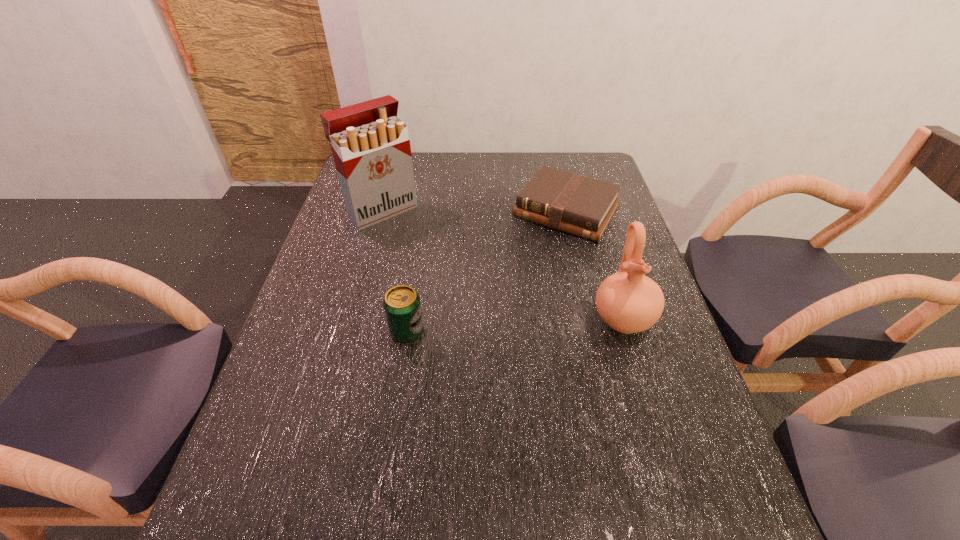
Find the location of a particular element. The width and height of the screenshot is (960, 540). vacant spot on the desktop that is between the second shortest object and the pottery and is positioned with the lid open on the tallest object is located at coordinates (501, 326).

Where is `free space on the desktop that is between the third tallest object and the pottery and is positioned on the spine side of the shortest object`? This screenshot has width=960, height=540. free space on the desktop that is between the third tallest object and the pottery and is positioned on the spine side of the shortest object is located at coordinates (488, 327).